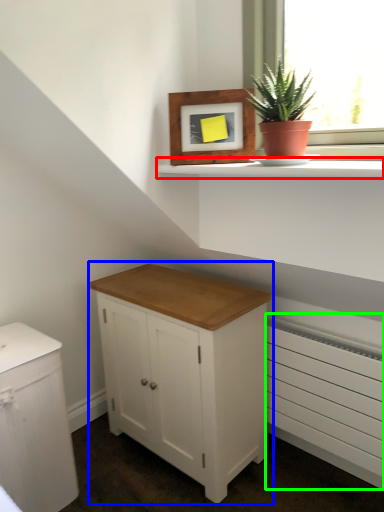
Question: Based on their relative distances, which object is nearer to window sill (highlighted by a red box)? Choose from chest of drawers (highlighted by a blue box) and radiator (highlighted by a green box).

Choices:
 (A) chest of drawers
 (B) radiator

Answer: (A)